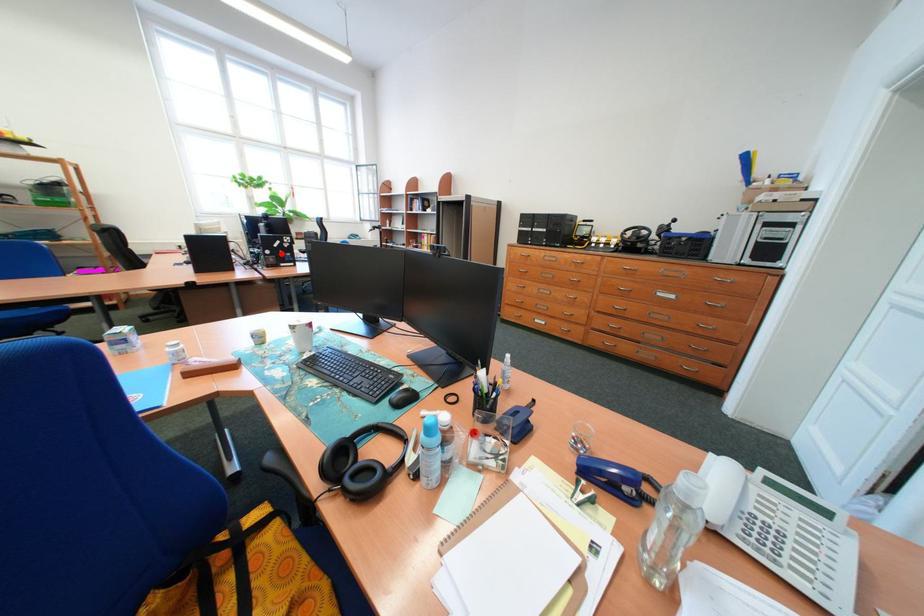
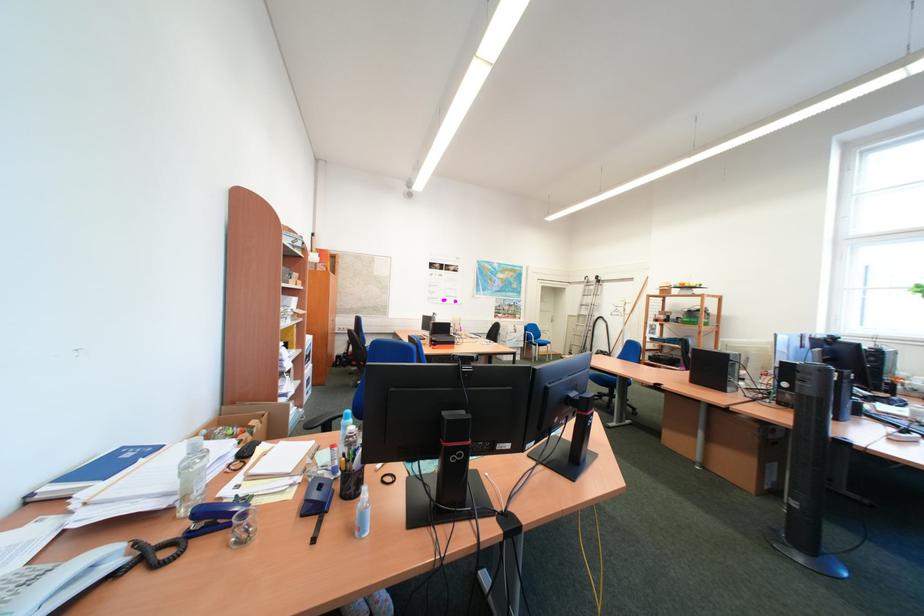
Question: A red point is marked in image1. In image2, is the corresponding 3D point closer to the camera or farther? Reply with the corresponding letter.

Choices:
 (A) The corresponding 3D point is closer.
 (B) The corresponding 3D point is farther.

Answer: (B)